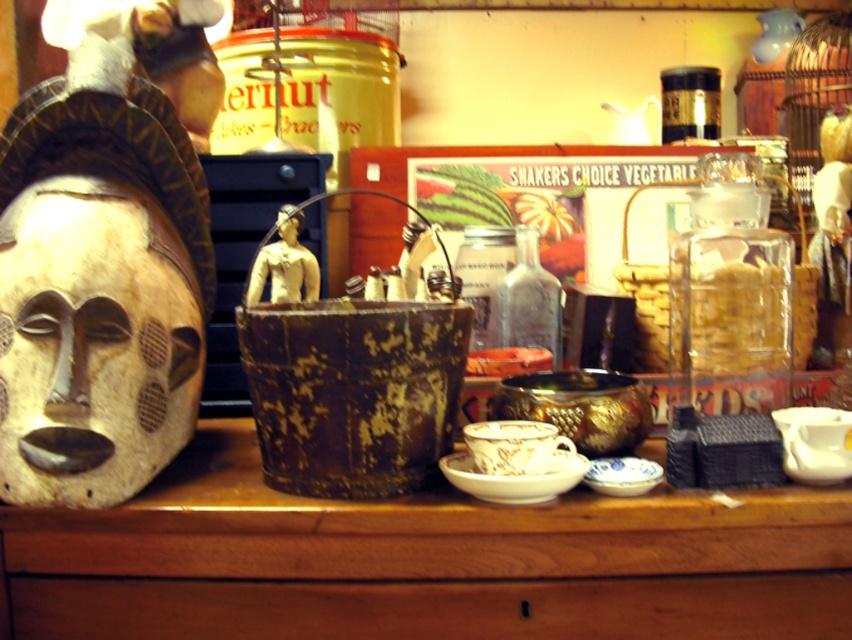
Where is the wooden table at center located in the image?

The wooden table at center is located at point 0.877 on the x axis and 0.499 on the y axis.

You are organizing a museum exhibit and need to ensure proper spacing between the wooden mask at left and the matte yellow head at center. Based on their positions, which object is positioned lower on the shelf?

The wooden mask at left is positioned lower on the shelf than the matte yellow head at center, as it is described to be below it.

You are trying to place a rectangular box that is 1 meter wide on the wooden table at center. The wooden mask at left is currently placed on the edge of the table. Will the box fit entirely on the table without overlapping the mask?

The wooden table at center might be wider than wooden mask at left, so there is a possibility that the box could fit without overlapping, but the exact width of the table isn not specified. However, since the mask is on the edge, moving it might allow the box to fit.